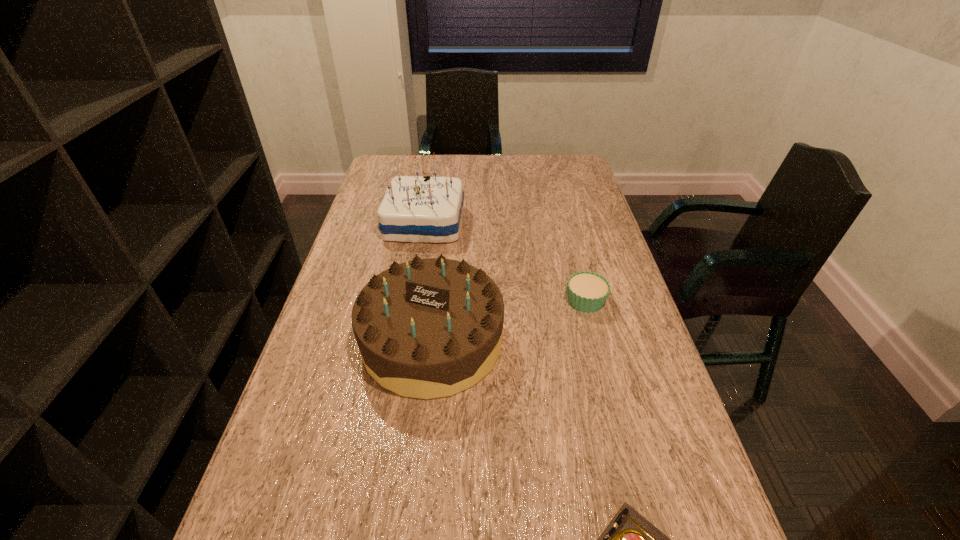
The image size is (960, 540). In order to click on the taller birthday cake in this screenshot , I will do `click(417, 209)`.

You are a GUI agent. You are given a task and a screenshot of the screen. Output one action in this format:
    pyautogui.click(x=<x>, y=<y>)
    Task: Click on the farthest object
    The width and height of the screenshot is (960, 540).
    Given the screenshot: What is the action you would take?
    pyautogui.click(x=417, y=209)

The image size is (960, 540). I want to click on the shorter birthday cake, so click(428, 328).

Where is `the second tallest object`? This screenshot has width=960, height=540. the second tallest object is located at coordinates (428, 328).

This screenshot has height=540, width=960. In order to click on cupcake in this screenshot , I will do `click(587, 291)`.

In order to click on free region located on the right of the taller birthday cake in this screenshot , I will do coord(533,223).

Locate an element on the screen. vacant region located 0.220m on the front-facing side of the nearer birthday cake is located at coordinates (414, 514).

What are the coordinates of `vacant position located on the front of the cupcake` in the screenshot? It's located at (611, 398).

Identify the location of object at the right edge. (587, 291).

What are the coordinates of `vacant space at the left edge of the desktop` in the screenshot? It's located at (347, 280).